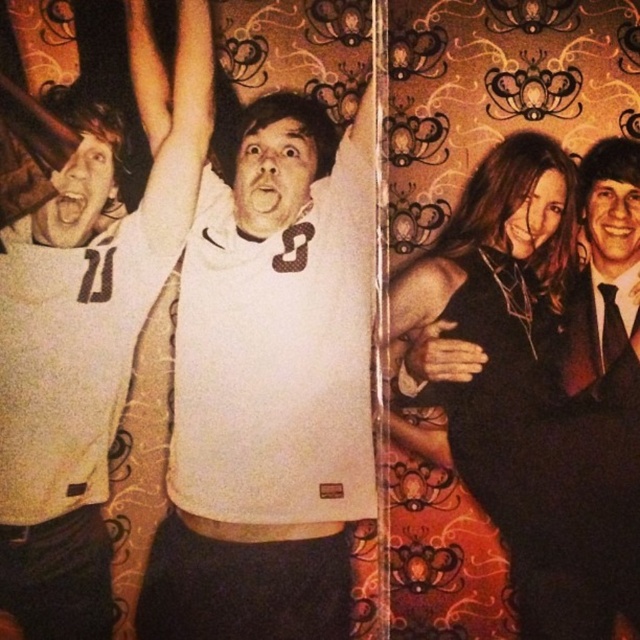
You are a photographer who needs to capture a closeup shot of both the white jersey at left and the black satin suit at right without moving the subjects. Given your camera has a maximum focus range of 1 meter, can you achieve this?

The white jersey at left is 91.89 centimeters away from the black satin suit at right. Since 91.89 cm is less than 1 meter, the camera can focus on both subjects simultaneously within the maximum focus range of 1 meter.

You are a photographer at the event. You want to place a decorative ribbon between the white matte jersey at center and the black satin dress at center. Based on their widths, which object should the ribbon be closer to to ensure it doesn

The white matte jersey at center has a lesser width compared to the black satin dress at center, so the ribbon should be placed closer to the white matte jersey at center to balance their widths.

You are standing in the room depicted in the image. There is a point marked at coordinates (84,353). What object in the scene corresponds to this point?

The point at coordinates (84,353) corresponds to the white jersey at left.